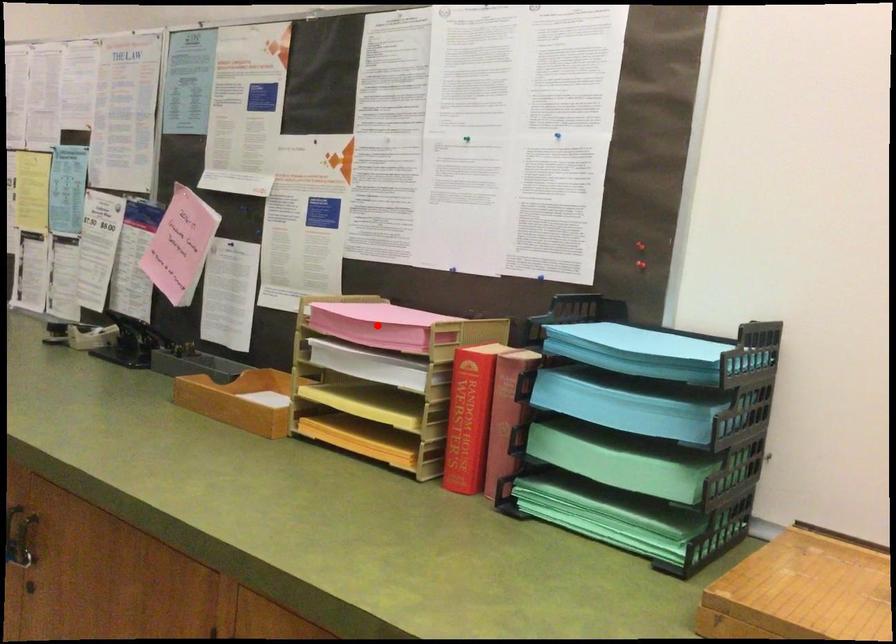
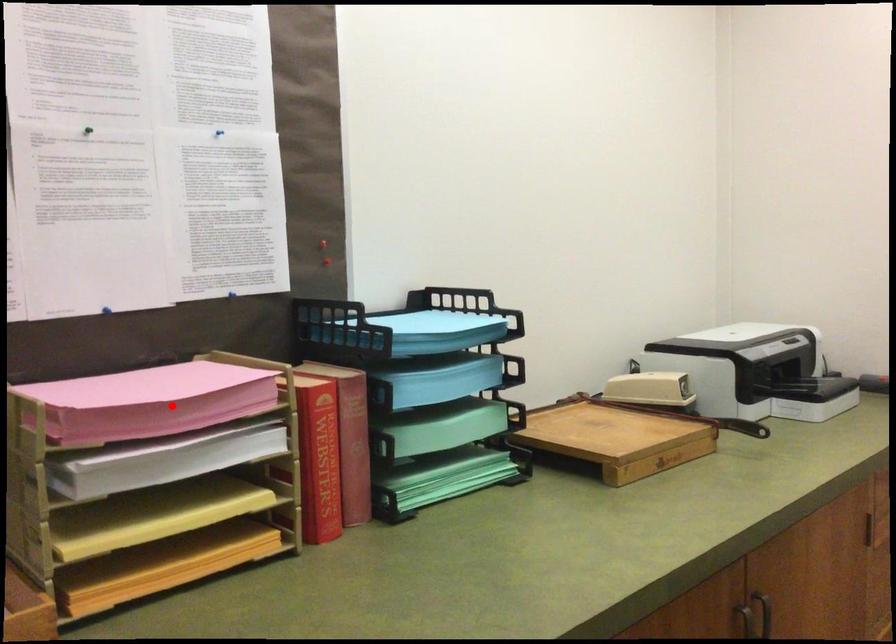
I am providing you with two images of the same scene from different viewpoints. A red point is marked on the first image and another point is marked on the second image. Is the red point in image1 aligned with the point shown in image2?

Yes